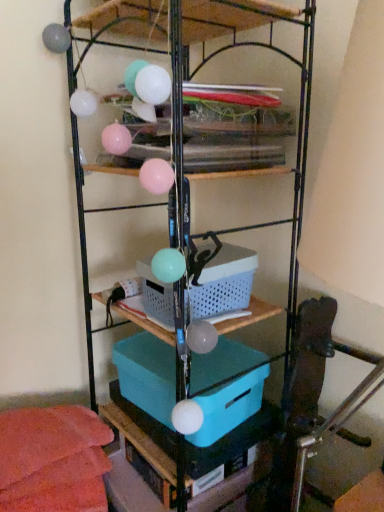
Question: Is blue plastic basket at center taller than plastic/mesh basket at center?

Choices:
 (A) yes
 (B) no

Answer: (A)

Question: From the image's perspective, is blue plastic basket at center over plastic/mesh basket at center?

Choices:
 (A) yes
 (B) no

Answer: (B)

Question: Is blue plastic basket at center bigger than plastic/mesh basket at center?

Choices:
 (A) no
 (B) yes

Answer: (B)

Question: From a real-world perspective, is blue plastic basket at center under plastic/mesh basket at center?

Choices:
 (A) no
 (B) yes

Answer: (B)

Question: Is blue plastic basket at center in contact with plastic/mesh basket at center?

Choices:
 (A) no
 (B) yes

Answer: (A)

Question: Visually, is teal plastic box at center positioned to the left or to the right of blue plastic basket at center?

Choices:
 (A) right
 (B) left

Answer: (B)

Question: In terms of height, does teal plastic box at center look taller or shorter compared to blue plastic basket at center?

Choices:
 (A) tall
 (B) short

Answer: (B)

Question: Considering the positions of point (211, 373) and point (150, 23), is point (211, 373) closer or farther from the camera than point (150, 23)?

Choices:
 (A) farther
 (B) closer

Answer: (A)

Question: From the image's perspective, is teal plastic box at center positioned above or below blue plastic basket at center?

Choices:
 (A) below
 (B) above

Answer: (A)

Question: From a real-world perspective, is plastic/mesh basket at center physically located above or below teal plastic box at center?

Choices:
 (A) above
 (B) below

Answer: (A)

Question: From the image's perspective, is plastic/mesh basket at center above or below teal plastic box at center?

Choices:
 (A) above
 (B) below

Answer: (A)

Question: In terms of width, does plastic/mesh basket at center look wider or thinner when compared to teal plastic box at center?

Choices:
 (A) thin
 (B) wide

Answer: (A)

Question: In terms of height, does plastic/mesh basket at center look taller or shorter compared to teal plastic box at center?

Choices:
 (A) tall
 (B) short

Answer: (B)

Question: Choose the correct answer: Is plastic/mesh basket at center inside blue plastic basket at center or outside it?

Choices:
 (A) outside
 (B) inside

Answer: (B)

Question: Looking at the image, does plastic/mesh basket at center seem bigger or smaller compared to blue plastic basket at center?

Choices:
 (A) small
 (B) big

Answer: (A)